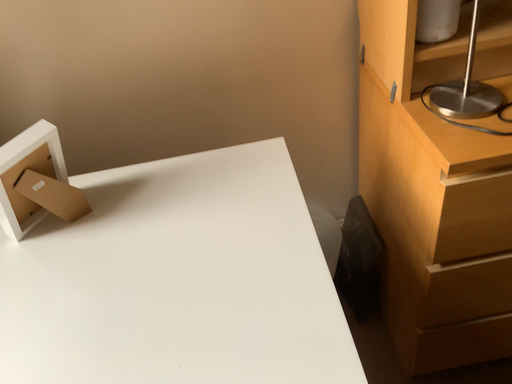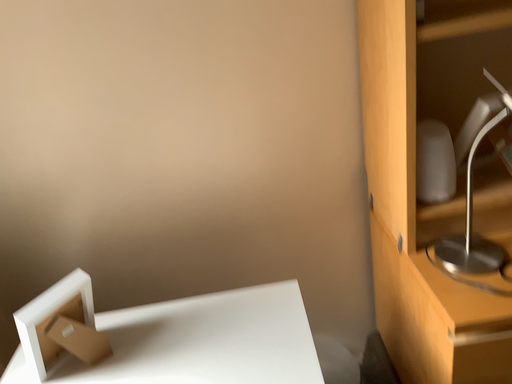
Question: How did the camera likely rotate when shooting the video?

Choices:
 (A) rotated downward
 (B) rotated upward

Answer: (B)